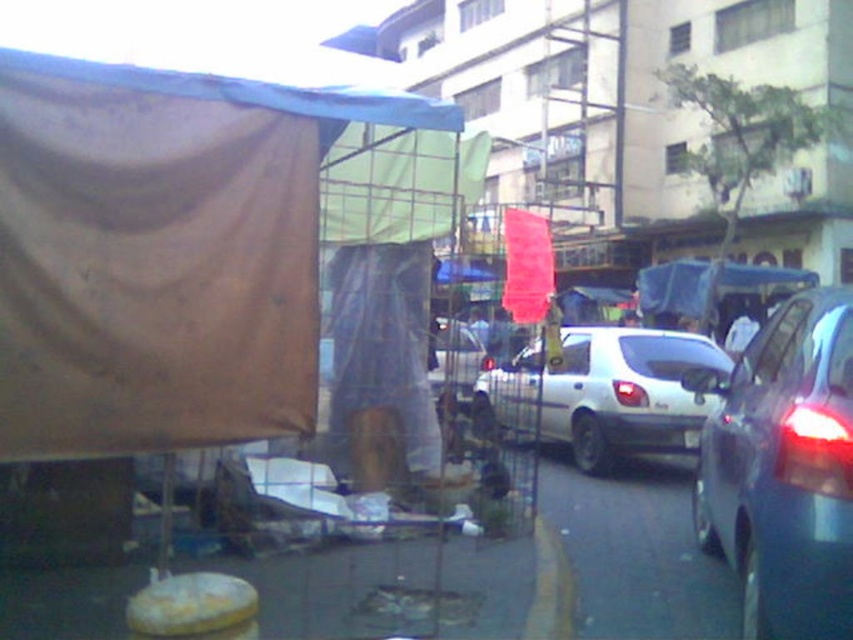
Who is positioned more to the left, brown fabric canopy at upper left or white matte hatchback at center?

brown fabric canopy at upper left is more to the left.

Which is behind, point (216, 244) or point (616, 456)?

Positioned behind is point (616, 456).

Is point (22, 147) more distant than point (671, 365)?

No, it is in front of (671, 365).

Where is `brown fabric canopy at upper left`? This screenshot has height=640, width=853. brown fabric canopy at upper left is located at coordinates (163, 252).

At what (x,y) coordinates should I click in order to perform the action: click on white matte hatchback at center. Please return your answer as a coordinate pair (x, y). The width and height of the screenshot is (853, 640). Looking at the image, I should click on (602, 394).

Between white matte hatchback at center and metallic silver car at center, which one has more height?

With more height is white matte hatchback at center.

Is point (538, 342) positioned before point (468, 358)?

Yes.

At what (x,y) coordinates should I click in order to perform the action: click on white matte hatchback at center. Please return your answer as a coordinate pair (x, y). Looking at the image, I should click on (602, 394).

Between point (171, 124) and point (473, 355), which one is positioned behind?

Positioned behind is point (473, 355).

Find the location of `brown fabric canopy at upper left`. brown fabric canopy at upper left is located at coordinates (163, 252).